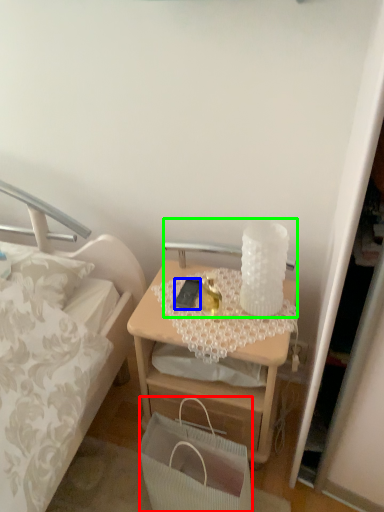
Question: Which is nearer to the handbag (highlighted by a red box)? mobile phone (highlighted by a blue box) or table lamp (highlighted by a green box).

Choices:
 (A) mobile phone
 (B) table lamp

Answer: (A)